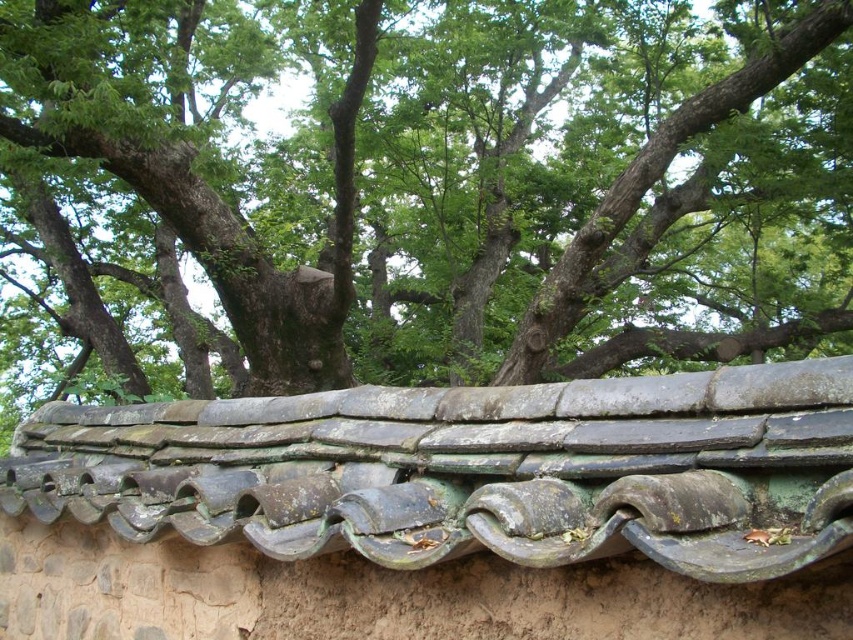
Question: Is green leafy tree at upper center behind greenish-brown clay tiles at center?

Choices:
 (A) yes
 (B) no

Answer: (A)

Question: Does green leafy tree at upper center have a lesser width compared to greenish-brown clay tiles at center?

Choices:
 (A) yes
 (B) no

Answer: (B)

Question: Which object appears farthest from the camera in this image?

Choices:
 (A) green leafy tree at upper center
 (B) greenish-brown clay tiles at center

Answer: (A)

Question: Which point is closer to the camera?

Choices:
 (A) greenish-brown clay tiles at center
 (B) green leafy tree at upper center

Answer: (A)

Question: Does green leafy tree at upper center appear on the right side of greenish-brown clay tiles at center?

Choices:
 (A) no
 (B) yes

Answer: (A)

Question: Which point appears closest to the camera in this image?

Choices:
 (A) 788,467
 (B) 740,356

Answer: (A)